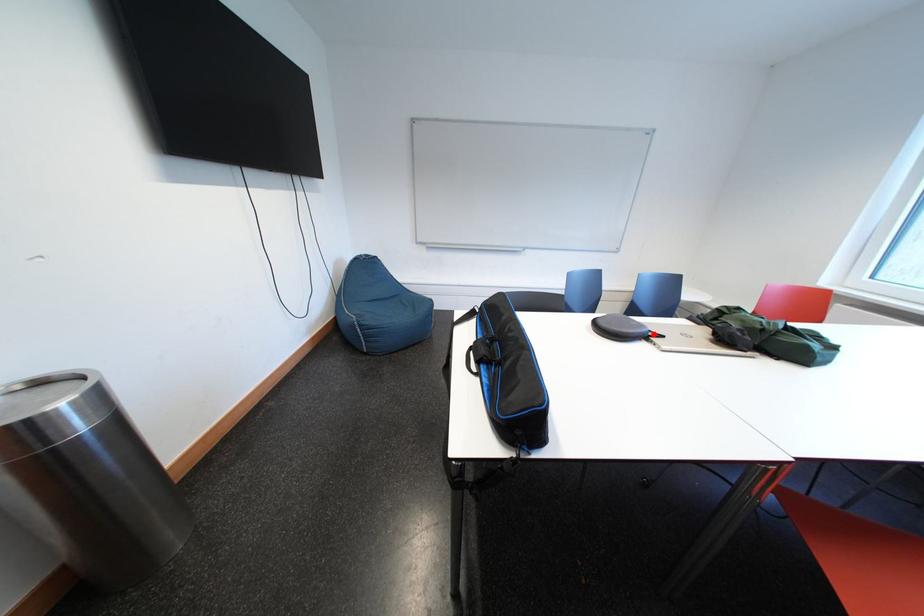
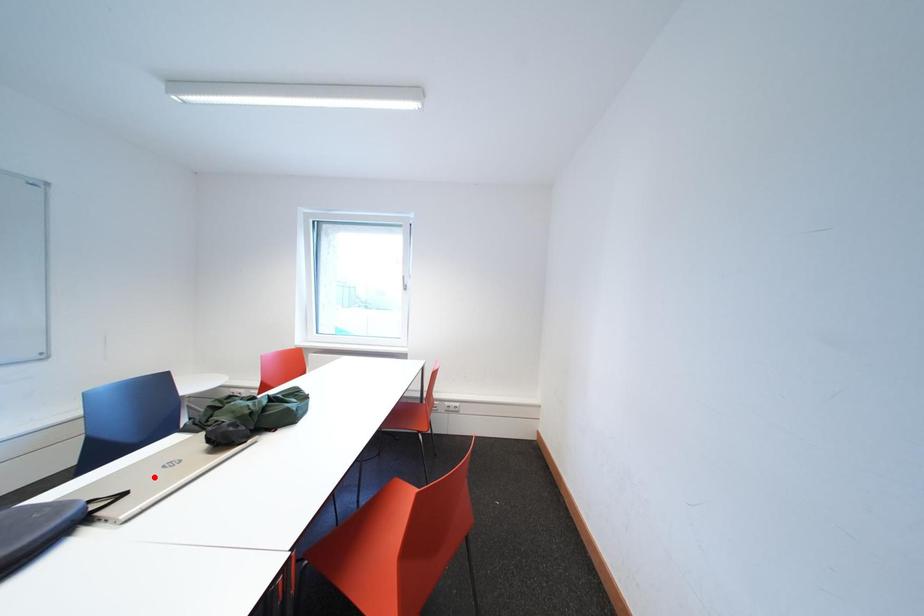
I am providing you with two images of the same scene from different viewpoints. A red point is marked on the first image and another point is marked on the second image. Is the red point in image1 aligned with the point shown in image2?

No